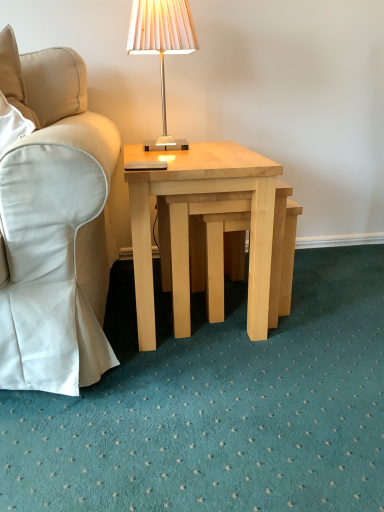
At what (x,y) coordinates should I click in order to perform the action: click on vacant space to the right of light wood step stool at center. Please return your answer as a coordinate pair (x, y). This screenshot has width=384, height=512. Looking at the image, I should click on (336, 312).